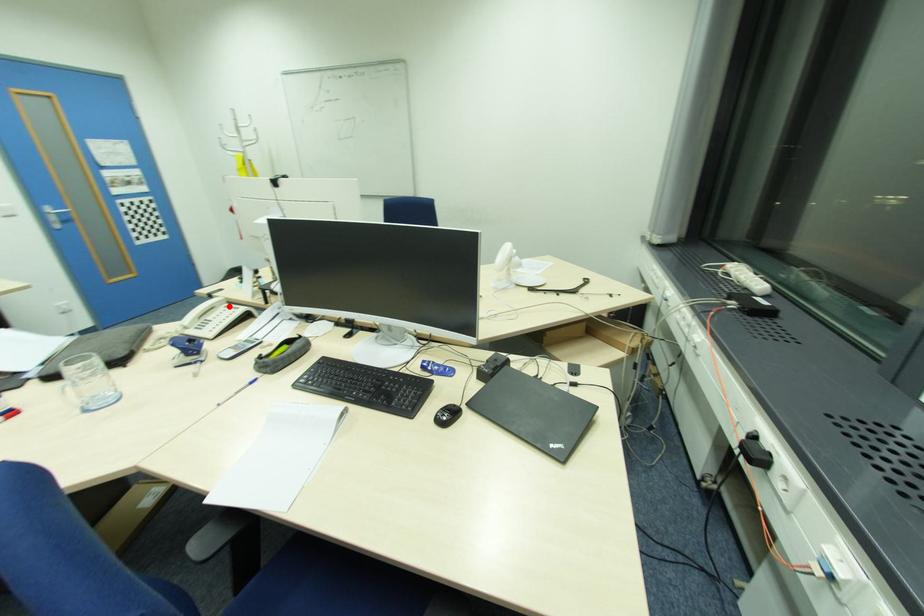
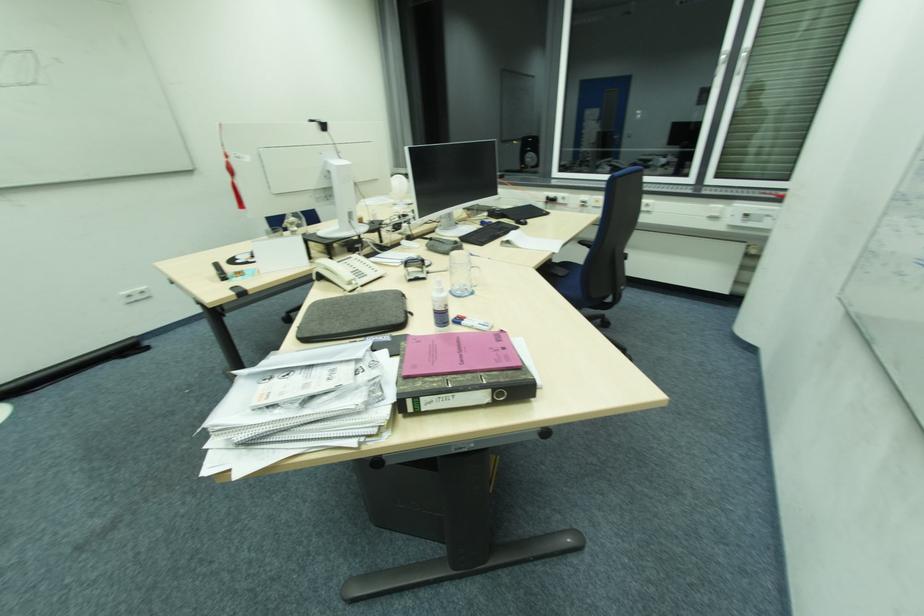
Where in the second image is the point corresponding to the highlighted location from the first image?

(342, 262)